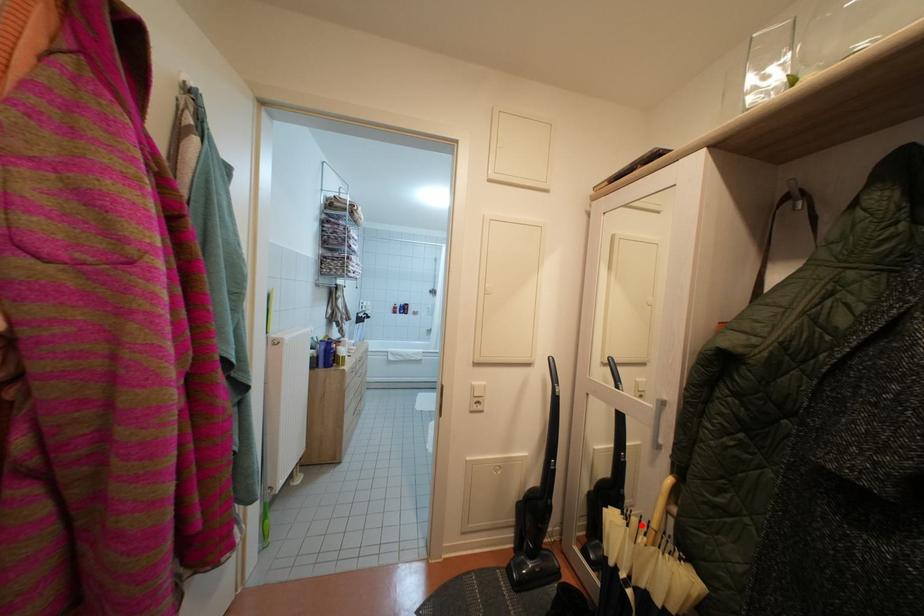
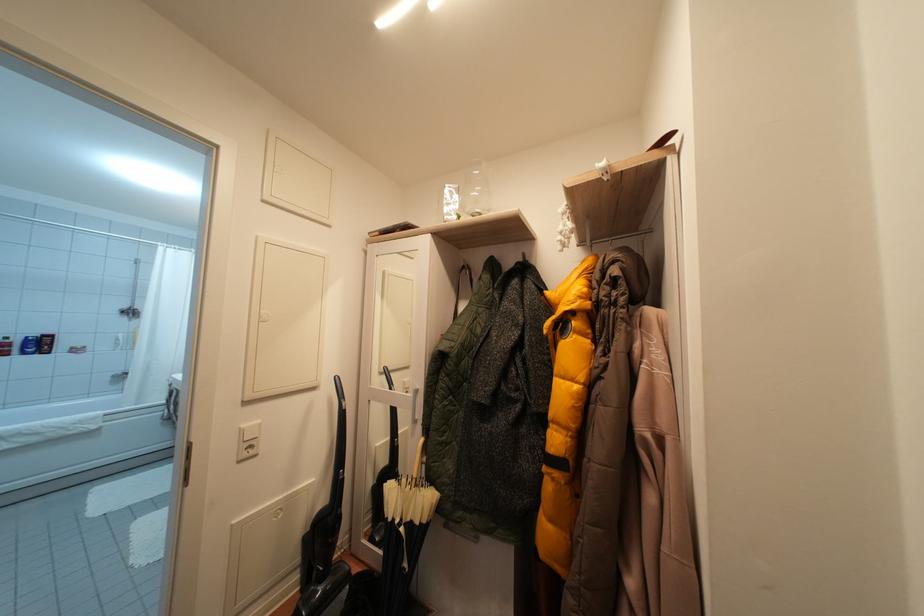
The point at the highlighted location is marked in the first image. Where is the corresponding point in the second image?

(410, 485)